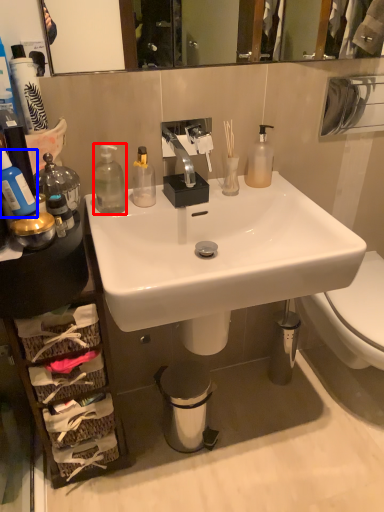
Question: Among these objects, which one is nearest to the camera, bottle (highlighted by a red box) or bottle (highlighted by a blue box)?

Choices:
 (A) bottle
 (B) bottle

Answer: (B)